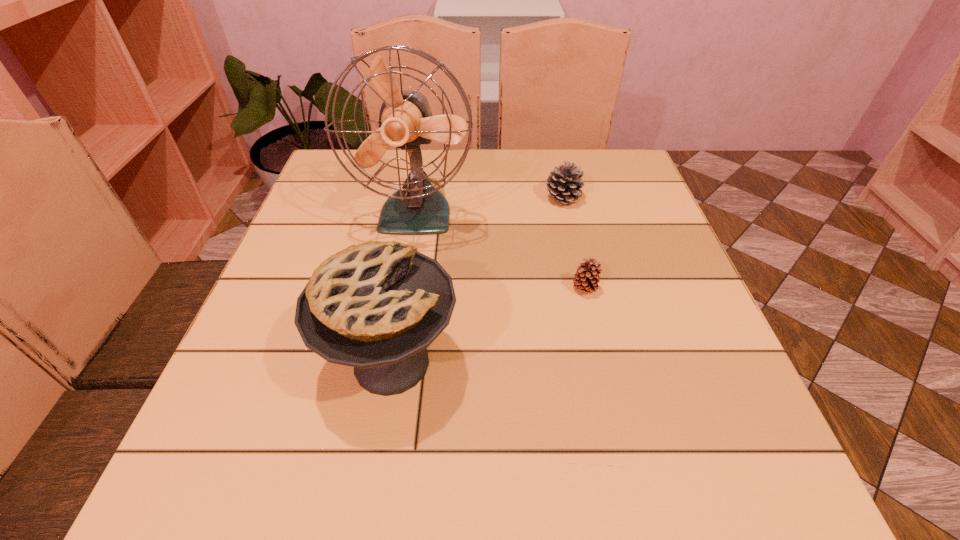
In the image, there is a desktop. In order to click on vacant space at the far left corner in this screenshot , I will do `click(336, 150)`.

Locate an element on the screen. The height and width of the screenshot is (540, 960). vacant space at the near left corner of the desktop is located at coordinates (298, 459).

This screenshot has width=960, height=540. Identify the location of vacant area at the far right corner of the desktop. (621, 179).

Locate an element on the screen. vacant space that's between the shorter pinecone and the farther pinecone is located at coordinates (573, 244).

This screenshot has height=540, width=960. In order to click on unoccupied area between the taller pinecone and the second tallest object in this screenshot , I will do `click(477, 280)`.

The height and width of the screenshot is (540, 960). Identify the location of vacant space that's between the shortest object and the third tallest object. (573, 244).

What are the coordinates of `free space between the third tallest object and the second nearest object` in the screenshot? It's located at (573, 244).

Locate an element on the screen. The height and width of the screenshot is (540, 960). free spot between the second nearest object and the farther pinecone is located at coordinates (573, 244).

Locate an element on the screen. free space between the fan and the shorter pinecone is located at coordinates (500, 251).

Image resolution: width=960 pixels, height=540 pixels. In order to click on object that is the third closest to the second nearest object in this screenshot , I will do `click(564, 182)`.